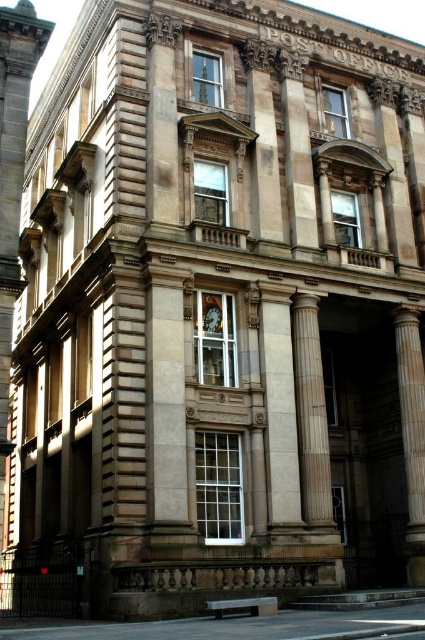
Question: Does white marble column at center have a lesser width compared to matte glass clock at center?

Choices:
 (A) yes
 (B) no

Answer: (B)

Question: Which point appears closest to the camera in this image?

Choices:
 (A) (422, 497)
 (B) (282, 488)

Answer: (B)

Question: Is white marble pillar at center to the right of white marble column at center from the viewer's perspective?

Choices:
 (A) no
 (B) yes

Answer: (A)

Question: Which of the following is the farthest from the observer?

Choices:
 (A) (404, 406)
 (B) (291, 420)
 (C) (218, 332)

Answer: (A)

Question: Among these objects, which one is nearest to the camera?

Choices:
 (A) matte glass clock at center
 (B) white marble column at center

Answer: (A)

Question: Is smooth stone column at center to the left of white marble column at center from the viewer's perspective?

Choices:
 (A) yes
 (B) no

Answer: (A)